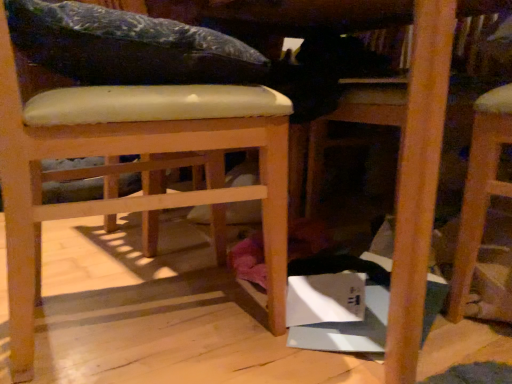
Find the location of a particular element. The width and height of the screenshot is (512, 384). matte wood chair at center is located at coordinates (133, 170).

This screenshot has width=512, height=384. Describe the element at coordinates (133, 170) in the screenshot. I see `matte wood chair at center` at that location.

Locate an element on the screen. The image size is (512, 384). matte wood chair at center is located at coordinates (133, 170).